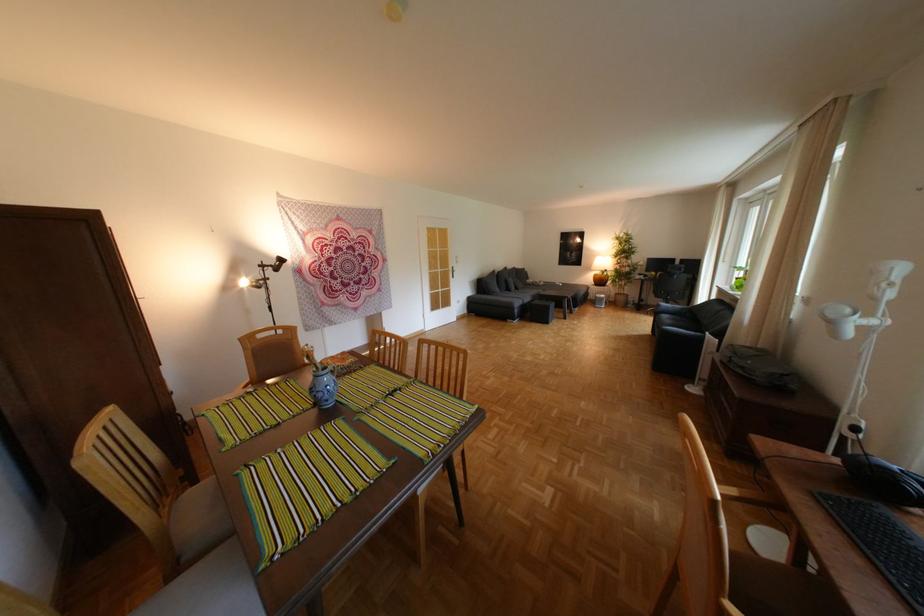
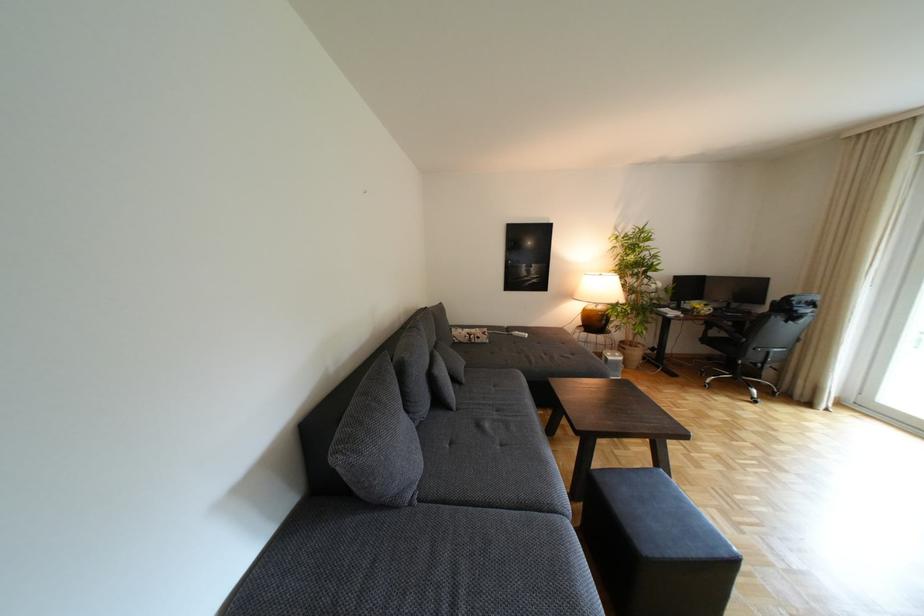
Where in the second image is the point corresponding to [529,288] from the first image?

(468, 379)